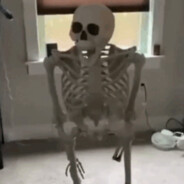
I want to click on window, so click(127, 29).